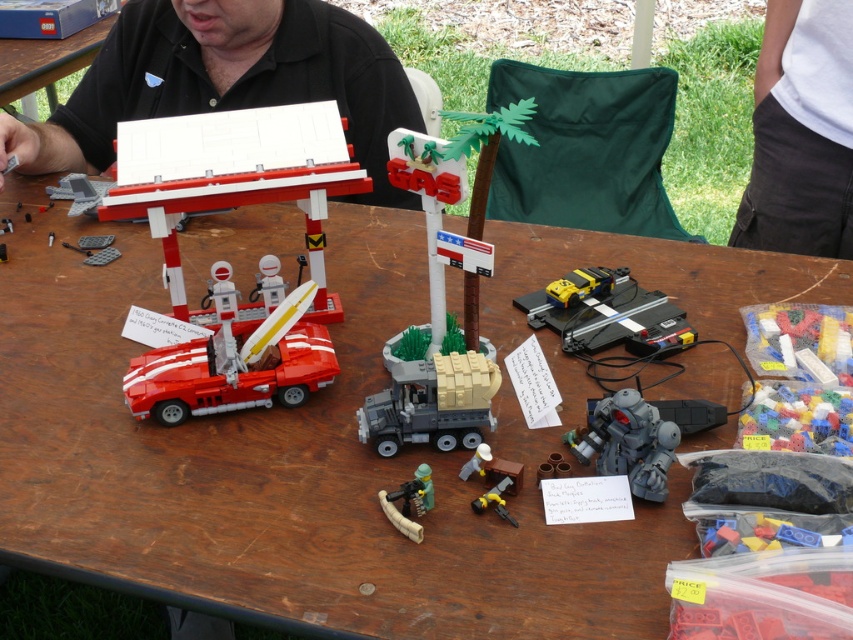
Question: From the image, what is the correct spatial relationship of translucent plastic bag at lower right in relation to translucent blue plastic bricks at lower right?

Choices:
 (A) left
 (B) right

Answer: (B)

Question: In this image, where is translucent blue plastic bricks at lower right located relative to metallic silver gun at center?

Choices:
 (A) above
 (B) below

Answer: (B)

Question: Which point appears closest to the camera in this image?

Choices:
 (A) (321, 192)
 (B) (705, 516)
 (C) (33, 60)

Answer: (B)

Question: Which of these objects is positioned closest to the matte black table at upper left?

Choices:
 (A) gray metallic robot at lower center
 (B) translucent plastic bag at lower right

Answer: (B)

Question: Does matte red car at left have a smaller size compared to metallic silver gun at center?

Choices:
 (A) no
 (B) yes

Answer: (A)

Question: Among these objects, which one is nearest to the camera?

Choices:
 (A) white matte gas station sign at upper center
 (B) yellow plastic car at center
 (C) black matte shirt at upper center
 (D) matte red car at left

Answer: (D)